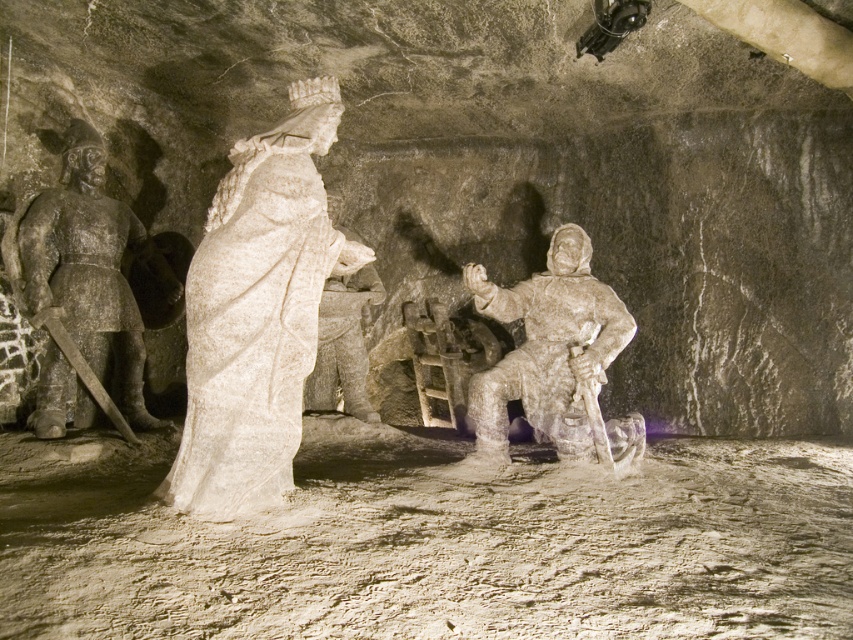
Question: Does white marble statue at center appear on the right side of dark gray stone warrior at left?

Choices:
 (A) no
 (B) yes

Answer: (B)

Question: Can you confirm if translucent white stone warrior at center is positioned to the right of white stone statue at center?

Choices:
 (A) yes
 (B) no

Answer: (A)

Question: Which of the following is the closest to the observer?

Choices:
 (A) (355, 276)
 (B) (514, 310)

Answer: (B)

Question: Which object is farther from the camera taking this photo?

Choices:
 (A) translucent white stone warrior at center
 (B) white marble statue at center

Answer: (A)

Question: Is the position of white marble statue at center more distant than that of translucent white stone warrior at center?

Choices:
 (A) yes
 (B) no

Answer: (B)

Question: Estimate the real-world distances between objects in this image. Which object is farther from the white stone statue at center?

Choices:
 (A) translucent white stone warrior at center
 (B) white marble statue at center

Answer: (B)